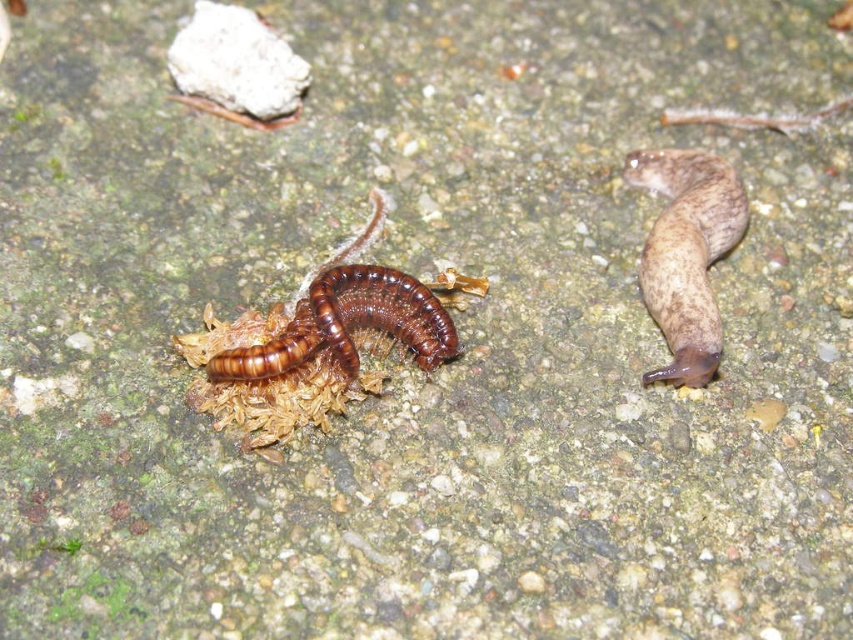
Does brown rubbery snail at right have a greater height compared to brown shiny centipede at center?

Correct, brown rubbery snail at right is much taller as brown shiny centipede at center.

Can you confirm if brown rubbery snail at right is positioned above brown shiny centipede at center?

Yes.

The image size is (853, 640). I want to click on brown rubbery snail at right, so tap(686, 253).